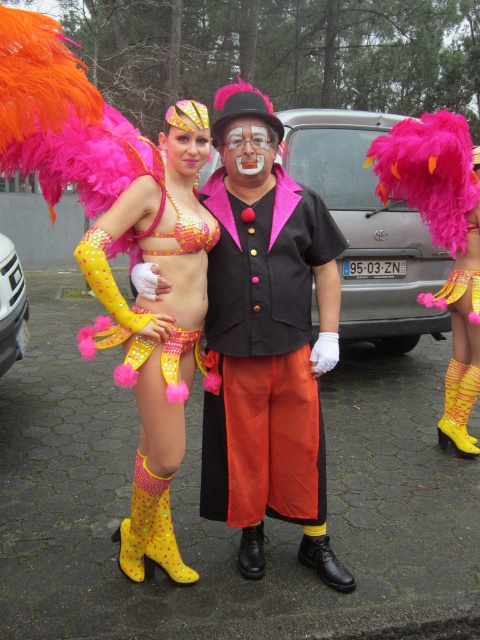
Question: Among these objects, which one is farthest from the camera?

Choices:
 (A) matte yellow sequined bikini top at center
 (B) fuzzy pink feathers at right
 (C) matte yellow costume at center

Answer: (B)

Question: Can you confirm if matte yellow sequined bikini top at center is thinner than fuzzy pink feathers at right?

Choices:
 (A) no
 (B) yes

Answer: (B)

Question: Can you confirm if matte yellow costume at center is wider than matte yellow sequined bikini top at center?

Choices:
 (A) yes
 (B) no

Answer: (A)

Question: Which point is farther to the camera?

Choices:
 (A) (168, 140)
 (B) (244, 556)
 (C) (396, 125)

Answer: (C)

Question: Is matte yellow costume at center smaller than fuzzy pink feathers at right?

Choices:
 (A) no
 (B) yes

Answer: (B)

Question: Which point is closer to the camera?

Choices:
 (A) matte yellow costume at center
 (B) fuzzy pink feathers at right
 (C) matte yellow sequined bikini top at center

Answer: (C)